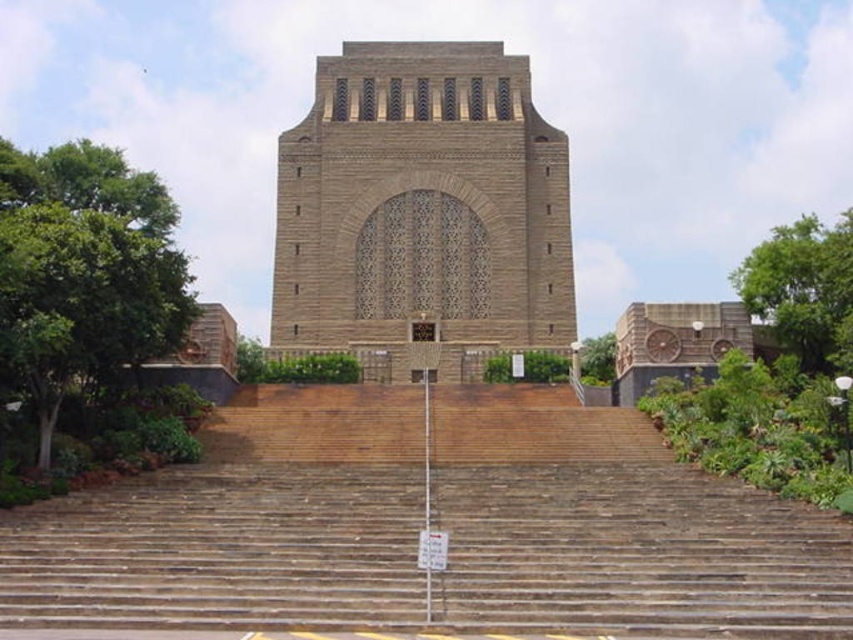
Is brown wooden stairs at center shorter than brown stone clock tower at right?

Indeed, brown wooden stairs at center has a lesser height compared to brown stone clock tower at right.

From the picture: Can you confirm if brown wooden stairs at center is positioned to the left of brown stone clock tower at right?

Yes, brown wooden stairs at center is to the left of brown stone clock tower at right.

Does point (679, 616) come closer to viewer compared to point (641, 385)?

Yes, it is.

Where is `brown wooden stairs at center`? The width and height of the screenshot is (853, 640). brown wooden stairs at center is located at coordinates (616, 529).

Which is in front, point (412, 67) or point (604, 362)?

Point (604, 362) is more forward.

Does brown stone tower at center have a greater height compared to green leafy tree at center?

Yes.

What do you see at coordinates (422, 208) in the screenshot? I see `brown stone tower at center` at bounding box center [422, 208].

Find the location of a particular element. The height and width of the screenshot is (640, 853). brown stone tower at center is located at coordinates (422, 208).

Who is positioned more to the left, brown stone clock tower at right or green leafy tree at center?

brown stone clock tower at right is more to the left.

Between brown stone clock tower at right and green leafy tree at center, which one is positioned higher?

green leafy tree at center is above.

The width and height of the screenshot is (853, 640). In order to click on brown stone clock tower at right in this screenshot , I will do pos(674,342).